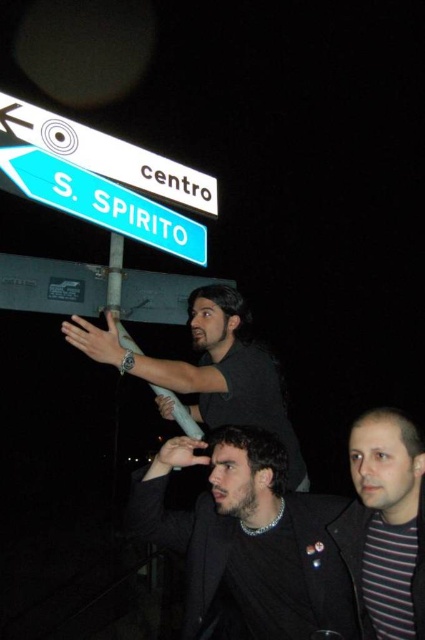
Between dark brown leather jacket at center and striped cotton shirt at lower right, which one is positioned higher?

striped cotton shirt at lower right is higher up.

Between dark brown leather jacket at center and striped cotton shirt at lower right, which one is positioned lower?

dark brown leather jacket at center is below.

Locate an element on the screen. dark brown leather jacket at center is located at coordinates (248, 541).

Identify the location of dark brown leather jacket at center. The image size is (425, 640). (248, 541).

Does dark brown leather jacket at center appear on the right side of blue glossy street sign at upper left?

Indeed, dark brown leather jacket at center is positioned on the right side of blue glossy street sign at upper left.

Between point (303, 620) and point (70, 195), which one is positioned behind?

Point (303, 620)

At what (x,y) coordinates should I click in order to perform the action: click on dark brown leather jacket at center. Please return your answer as a coordinate pair (x, y). This screenshot has height=640, width=425. Looking at the image, I should click on pyautogui.click(x=248, y=541).

Image resolution: width=425 pixels, height=640 pixels. What are the coordinates of `dark brown leather jacket at center` in the screenshot? It's located at (248, 541).

Between point (283, 410) and point (19, 150), which one is positioned in front?

Point (19, 150) is in front.

Does black matte shirt at upper center appear on the right side of blue glossy street sign at upper left?

Yes, black matte shirt at upper center is to the right of blue glossy street sign at upper left.

Who is more distant from viewer, (288,436) or (204,266)?

Point (288,436)

Locate an element on the screen. The image size is (425, 640). black matte shirt at upper center is located at coordinates (209, 369).